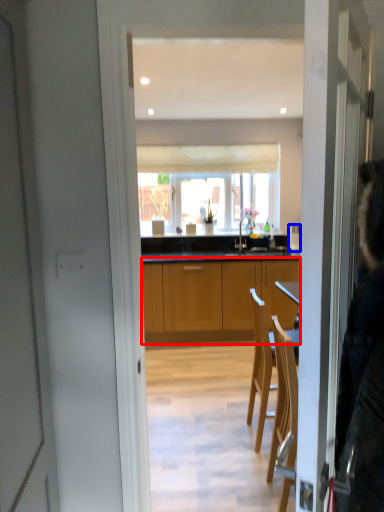
Question: Which object is further to the camera taking this photo, cabinetry (highlighted by a red box) or kitchen appliance (highlighted by a blue box)?

Choices:
 (A) cabinetry
 (B) kitchen appliance

Answer: (B)